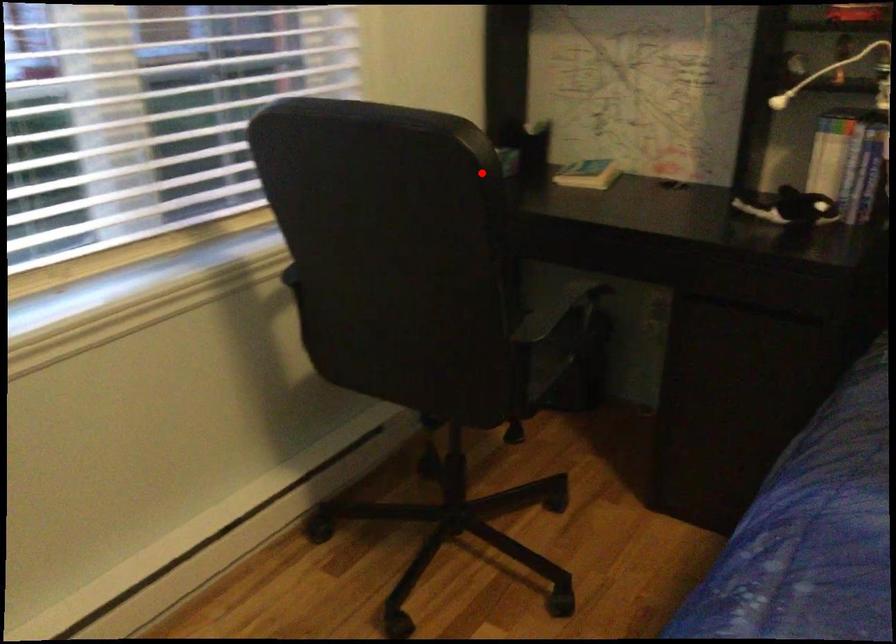
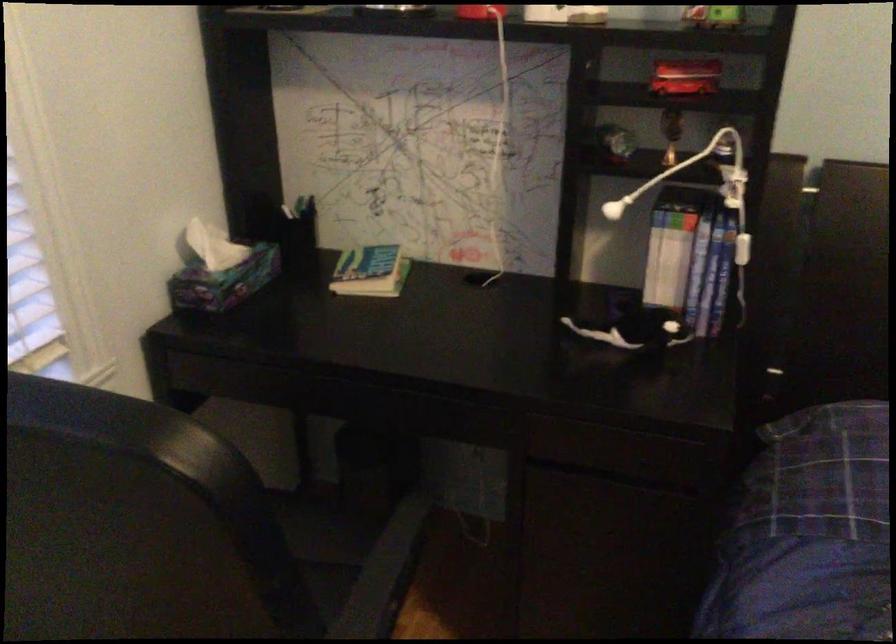
Question: I am providing you with two images of the same scene from different viewpoints. Image1 has a red point marked. In image2, the corresponding 3D location appears at what relative position? Reply with the corresponding letter.

Choices:
 (A) Closer
 (B) Farther

Answer: (A)